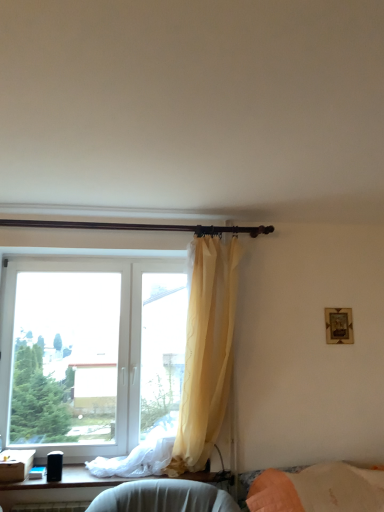
Question: Considering the positions of white plastic window at left and black plastic speaker at lower left in the image, is white plastic window at left bigger or smaller than black plastic speaker at lower left?

Choices:
 (A) big
 (B) small

Answer: (A)

Question: From the image's perspective, is white plastic window at left above or below black plastic speaker at lower left?

Choices:
 (A) above
 (B) below

Answer: (A)

Question: Which of these objects is positioned farthest from the gold metallic picture frame at upper right?

Choices:
 (A) black plastic speaker at lower left
 (B) dark brown wooden curtain rod at upper center
 (C) translucent yellow curtain at upper center
 (D) white plastic window at left

Answer: (A)

Question: Considering the real-world distances, which object is farthest from the black plastic speaker at lower left?

Choices:
 (A) translucent yellow curtain at upper center
 (B) white plastic window at left
 (C) gold metallic picture frame at upper right
 (D) dark brown wooden curtain rod at upper center

Answer: (C)